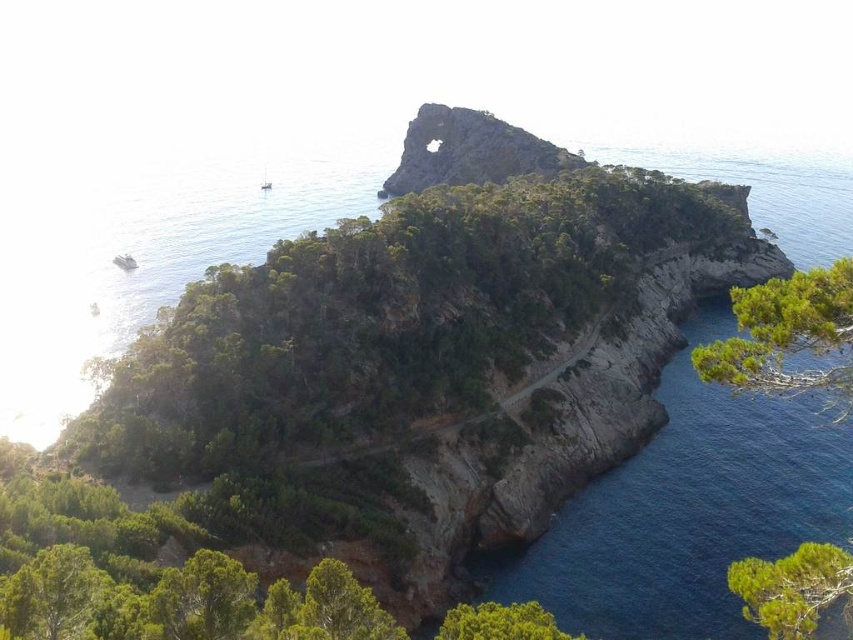
You are a hiker who wants to take a photo of the rusty stone arch at upper center and the green textured tree at lower right. Which object should you stand closer to in order to capture both in a single frame without zooming?

You should stand closer to the green textured tree at lower right because the rusty stone arch at upper center is much taller than the green textured tree at lower right, so reducing the distance to the shorter object allows both to fit in the frame.

You are standing at the base of the rocky island and want to take a photo of both the green leafy tree at lower right and the green leafy tree at lower left. Which tree should you position yourself closer to in order to include both in the frame without moving your camera position?

You should position yourself closer to the green leafy tree at lower right because it is nearer to you than the green leafy tree at lower left. By moving towards the closer tree, you can ensure both trees are within the camera frame without needing to adjust the camera position.